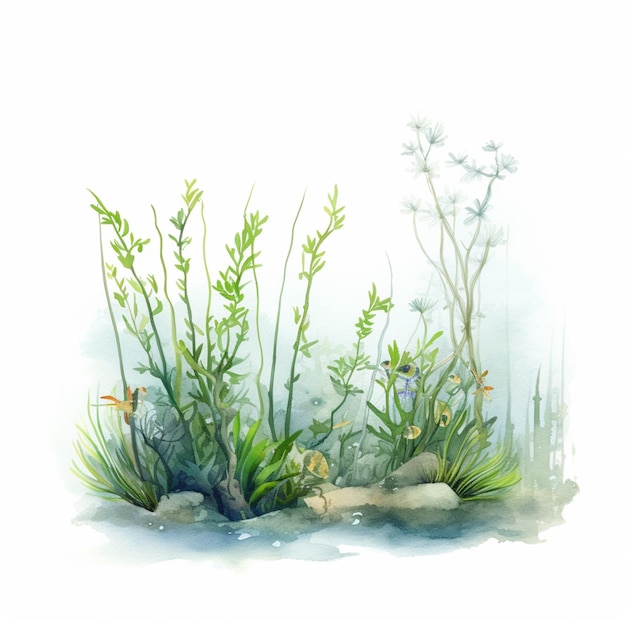
Find the location of `paint`. paint is located at coordinates (370, 330).